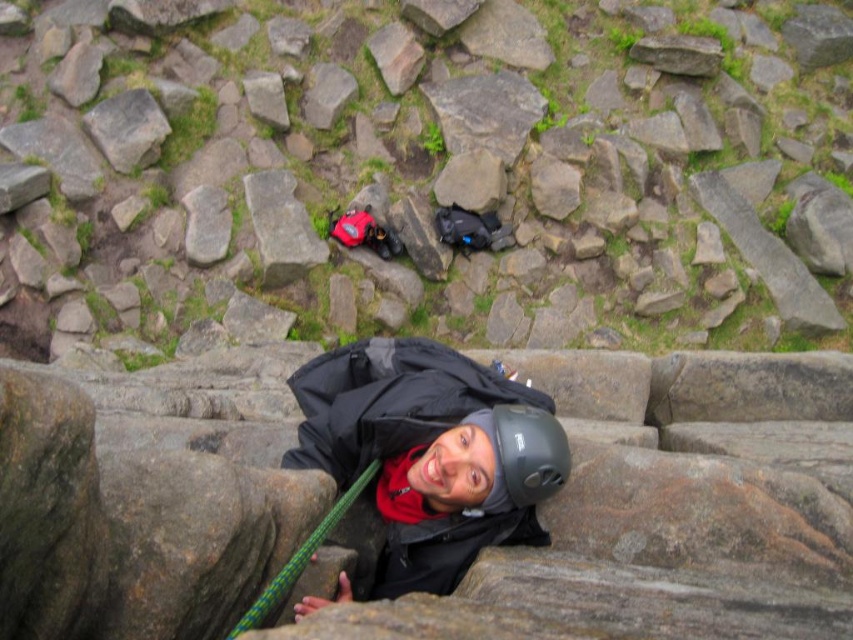
Which is in front, point (498, 461) or point (91, 124)?

Point (498, 461)

Who is lower down, matte black helmet at center or gray rough rock at upper left?

matte black helmet at center is below.

Locate an element on the screen. matte black helmet at center is located at coordinates (529, 452).

Who is lower down, smooth gray rock at center or gray rough rock at upper left?

smooth gray rock at center is lower down.

At what (x,y) coordinates should I click in order to perform the action: click on smooth gray rock at center. Please return your answer as a coordinate pair (x, y). Looking at the image, I should click on (440, 172).

The height and width of the screenshot is (640, 853). In order to click on smooth gray rock at center in this screenshot , I will do `click(440, 172)`.

Is smooth gray rock at center closer to camera compared to matte black helmet at center?

No, smooth gray rock at center is further to the viewer.

Which is behind, point (79, 301) or point (503, 444)?

The point (79, 301) is more distant.

This screenshot has height=640, width=853. Identify the location of smooth gray rock at center. (440, 172).